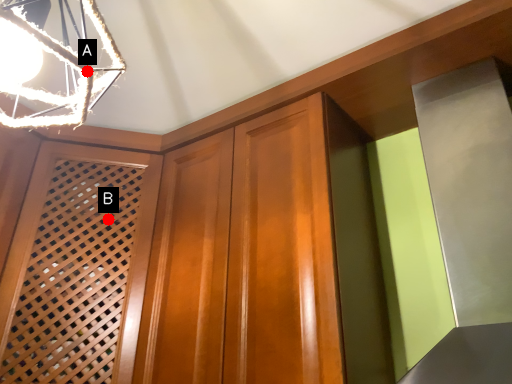
Question: Two points are circled on the image, labeled by A and B beside each circle. Which point is farther to the camera?

Choices:
 (A) A is further
 (B) B is further

Answer: (B)